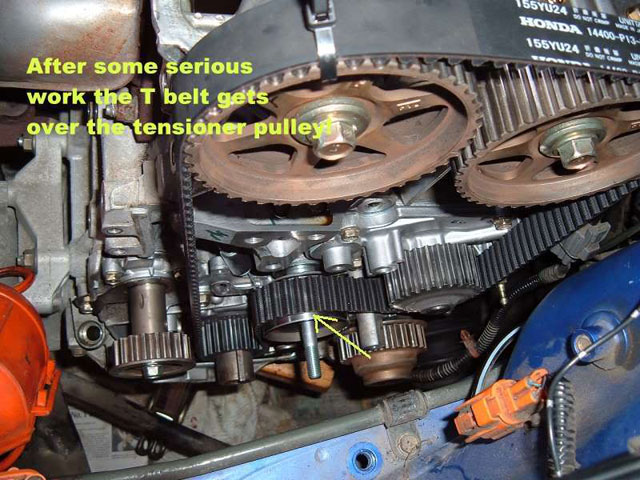
This screenshot has width=640, height=480. Identify the location of cord. (573, 362), (483, 367).